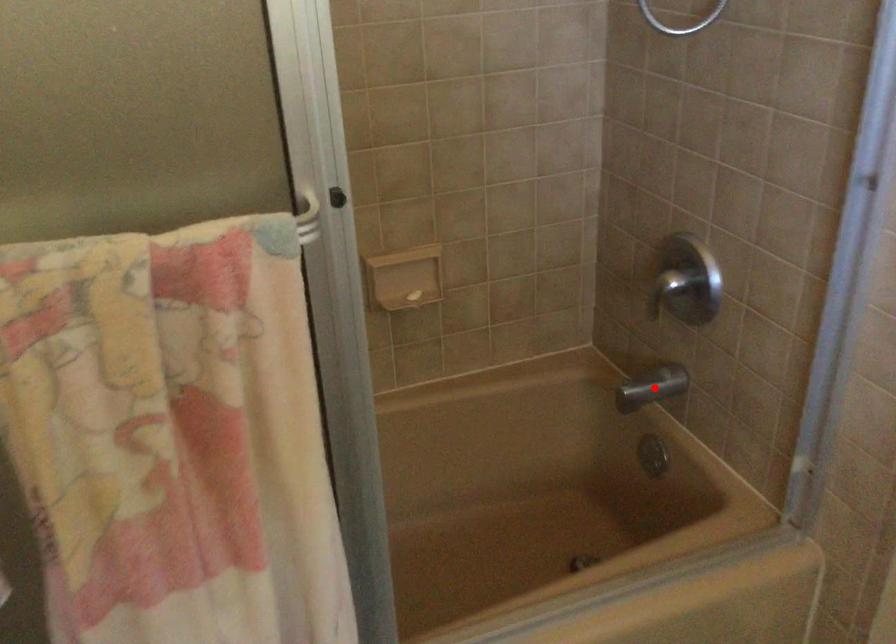
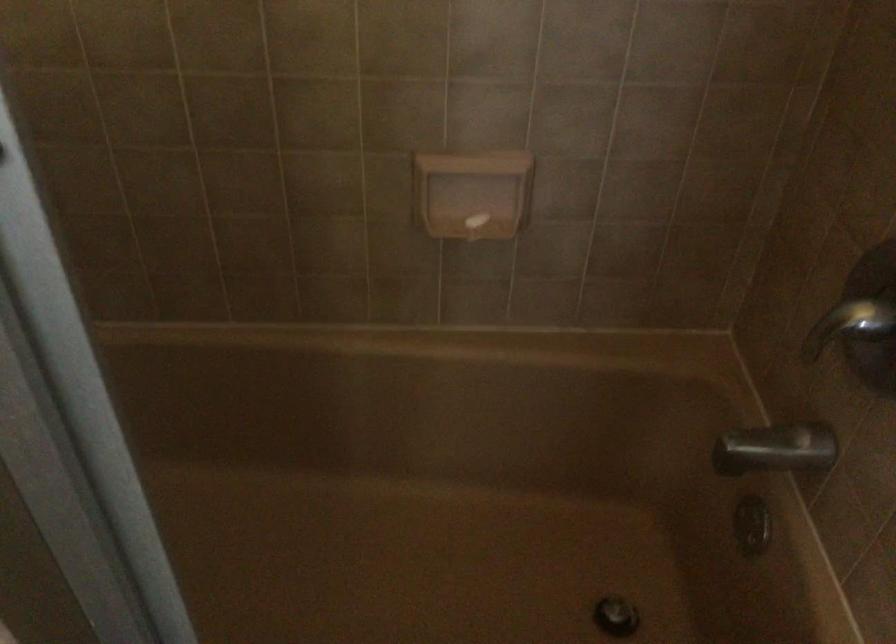
Find the pixel in the second image that matches the highlighted location in the first image.

(776, 449)